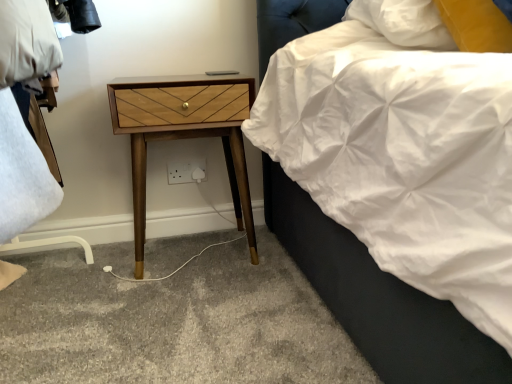
Question: In which direction should I rotate to look at white plastic electric outlet at lower center?

Choices:
 (A) right
 (B) left

Answer: (B)

Question: From the image's perspective, would you say woodenmaterial/texturenightstand at left is shown under white plastic electric outlet at lower center?

Choices:
 (A) no
 (B) yes

Answer: (A)

Question: Is woodenmaterial/texturenightstand at left located outside white plastic electric outlet at lower center?

Choices:
 (A) yes
 (B) no

Answer: (A)

Question: Is woodenmaterial/texturenightstand at left placed right next to white plastic electric outlet at lower center?

Choices:
 (A) no
 (B) yes

Answer: (A)

Question: Is woodenmaterial/texturenightstand at left at the left side of white plastic electric outlet at lower center?

Choices:
 (A) no
 (B) yes

Answer: (A)

Question: Is woodenmaterial/texturenightstand at left at the right side of white plastic electric outlet at lower center?

Choices:
 (A) no
 (B) yes

Answer: (B)

Question: Can you confirm if woodenmaterial/texturenightstand at left is smaller than white plastic electric outlet at lower center?

Choices:
 (A) yes
 (B) no

Answer: (B)

Question: Does white plastic electric outlet at lower center appear on the right side of woodenmaterial/texturenightstand at left?

Choices:
 (A) no
 (B) yes

Answer: (A)

Question: Is white plastic electric outlet at lower center not inside woodenmaterial/texturenightstand at left?

Choices:
 (A) yes
 (B) no

Answer: (A)

Question: Is white plastic electric outlet at lower center taller than woodenmaterial/texturenightstand at left?

Choices:
 (A) no
 (B) yes

Answer: (A)

Question: From the image's perspective, is white plastic electric outlet at lower center beneath woodenmaterial/texturenightstand at left?

Choices:
 (A) yes
 (B) no

Answer: (A)

Question: Considering the relative sizes of white plastic electric outlet at lower center and woodenmaterial/texturenightstand at left in the image provided, is white plastic electric outlet at lower center thinner than woodenmaterial/texturenightstand at left?

Choices:
 (A) yes
 (B) no

Answer: (A)

Question: From a real-world perspective, is white plastic electric outlet at lower center under woodenmaterial/texturenightstand at left?

Choices:
 (A) yes
 (B) no

Answer: (A)

Question: Considering the positions of white plastic electric outlet at lower center and woodenmaterial/texturenightstand at left in the image, is white plastic electric outlet at lower center taller or shorter than woodenmaterial/texturenightstand at left?

Choices:
 (A) tall
 (B) short

Answer: (B)